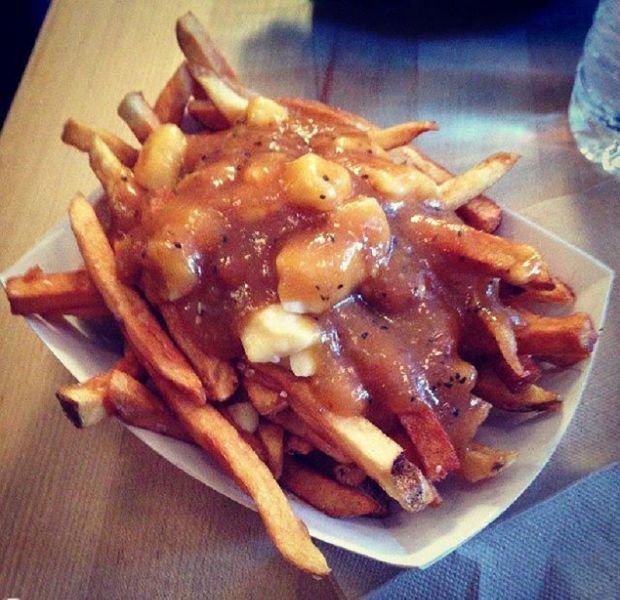
Image resolution: width=620 pixels, height=600 pixels. Identify the location of brown wood table. (113, 572).